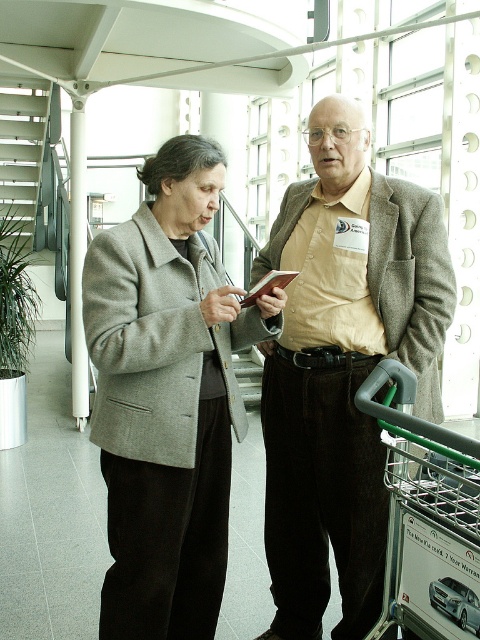
Question: Which of these objects is positioned closest to the gray woolen coat at center?

Choices:
 (A) beige woolen blazer at center
 (B) green metallic shopping cart at lower right

Answer: (A)

Question: Can you confirm if beige woolen blazer at center is bigger than gray woolen coat at center?

Choices:
 (A) yes
 (B) no

Answer: (A)

Question: Does gray woolen coat at center appear on the left side of green metallic shopping cart at lower right?

Choices:
 (A) yes
 (B) no

Answer: (A)

Question: Which point is farther from the camera taking this photo?

Choices:
 (A) tap(439, 586)
 (B) tap(376, 476)
 (C) tap(200, 134)

Answer: (C)

Question: Does gray woolen coat at center appear on the right side of green metallic shopping cart at lower right?

Choices:
 (A) no
 (B) yes

Answer: (A)

Question: Which object appears closest to the camera in this image?

Choices:
 (A) green metallic shopping cart at lower right
 (B) gray woolen coat at center

Answer: (A)